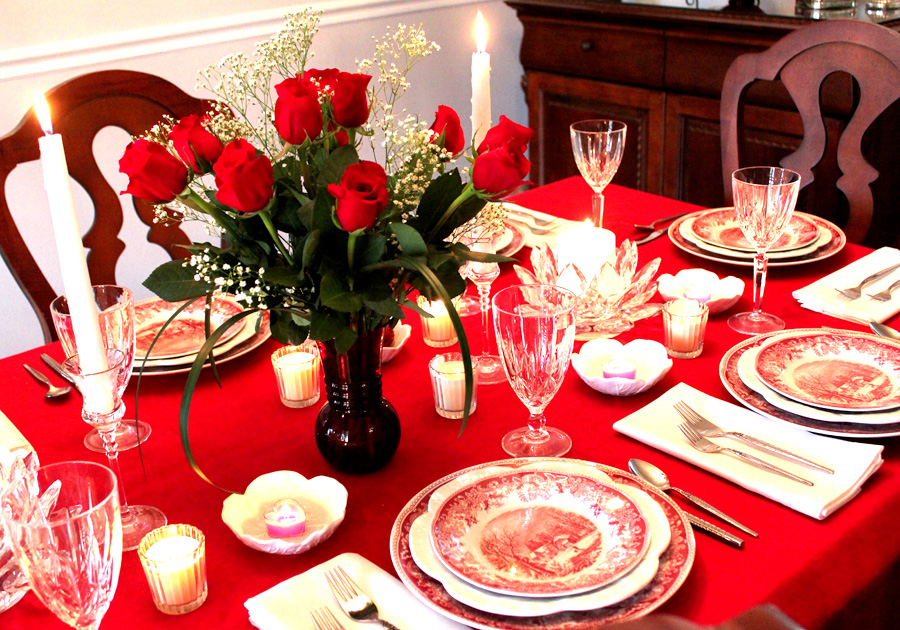
You are a GUI agent. You are given a task and a screenshot of the screen. Output one action in this format:
    pyautogui.click(x=<x>, y=<y>)
    Task: Click on the crystal glasses
    
    Given the screenshot: What is the action you would take?
    pyautogui.click(x=769, y=201), pyautogui.click(x=534, y=331), pyautogui.click(x=603, y=152), pyautogui.click(x=109, y=334), pyautogui.click(x=88, y=516)